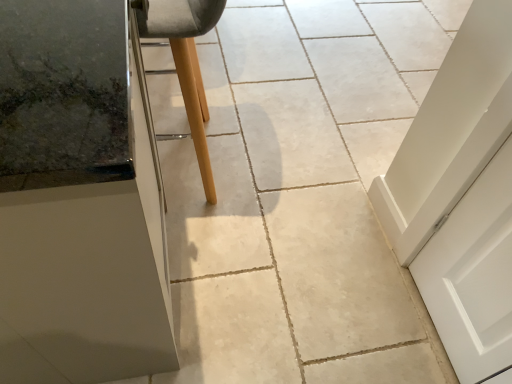
Where is `white matte door at right`? The width and height of the screenshot is (512, 384). white matte door at right is located at coordinates (473, 275).

What do you see at coordinates (473, 275) in the screenshot? This screenshot has height=384, width=512. I see `white matte door at right` at bounding box center [473, 275].

Where is `white matte door at right`? The image size is (512, 384). white matte door at right is located at coordinates (473, 275).